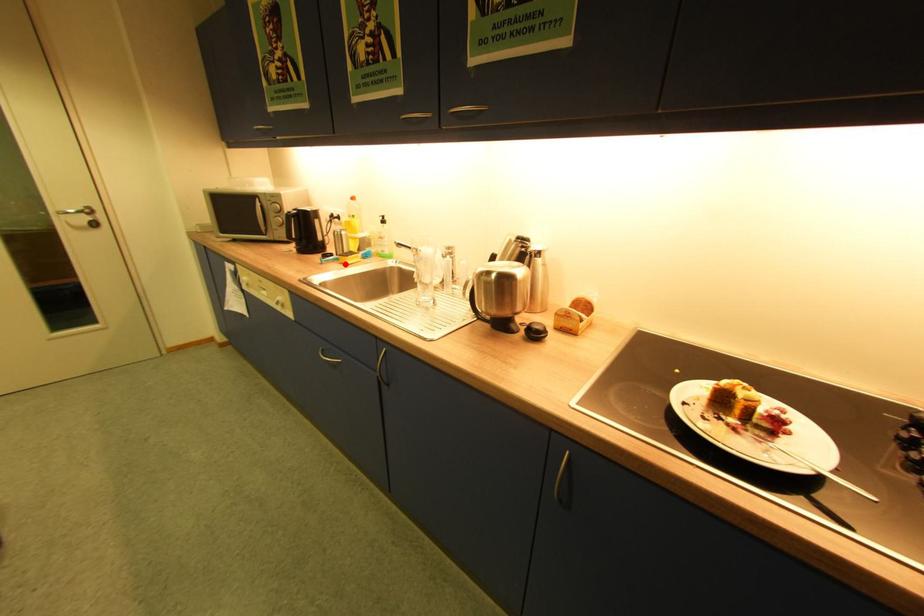
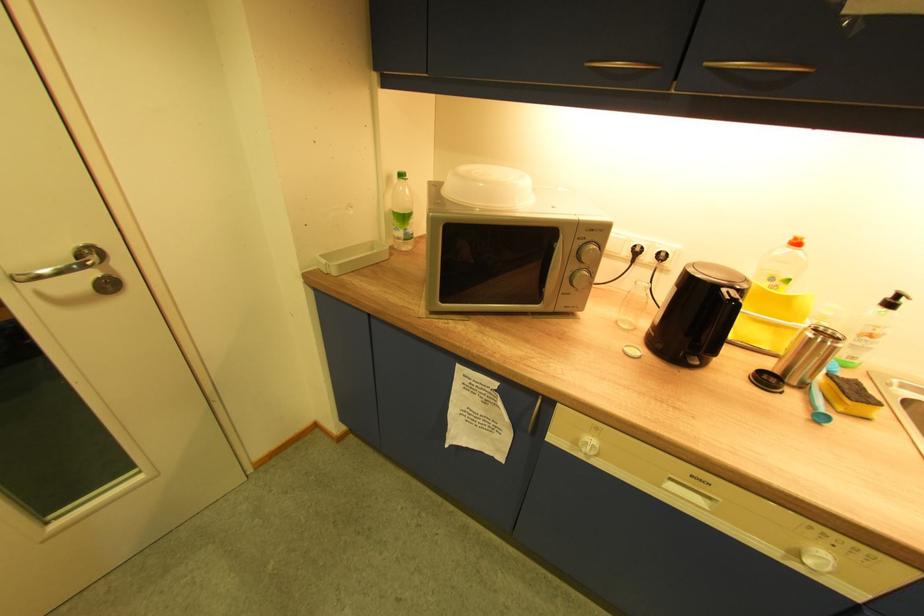
In the second image, find the point that corresponds to the highlighted location in the first image.

(843, 413)